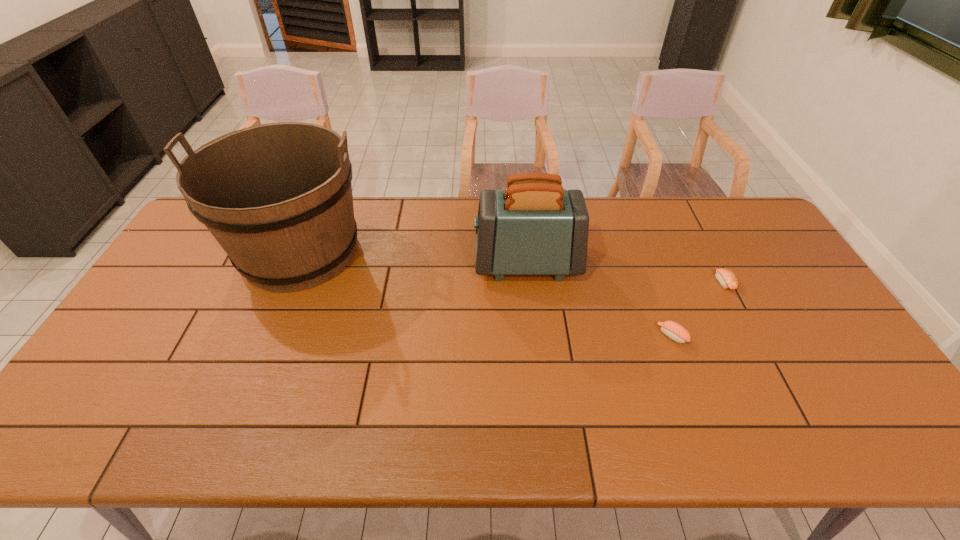
Identify the location of vacant region between the shorter sushi and the nearer sushi. (698, 309).

Find the location of a particular element. This screenshot has height=540, width=960. empty space between the bucket and the nearest object is located at coordinates (486, 294).

Locate an element on the screen. The height and width of the screenshot is (540, 960). vacant space in between the farther sushi and the toaster is located at coordinates (625, 273).

At what (x,y) coordinates should I click in order to perform the action: click on free area in between the third object from left to right and the leftmost object. Please return your answer as a coordinate pair (x, y). The height and width of the screenshot is (540, 960). Looking at the image, I should click on (486, 294).

This screenshot has height=540, width=960. Find the location of `vacant area that lies between the bucket and the second tallest object`. vacant area that lies between the bucket and the second tallest object is located at coordinates (414, 258).

The image size is (960, 540). Identify the location of empty space that is in between the taller sushi and the shorter sushi. (698, 309).

At what (x,y) coordinates should I click in order to perform the action: click on the closest object relative to the shorter sushi. Please return your answer as a coordinate pair (x, y). Looking at the image, I should click on tap(673, 330).

Choose which object is the second nearest neighbor to the third object from left to right. Please provide its 2D coordinates. Your answer should be formatted as a tuple, i.e. [(x, y)], where the tuple contains the x and y coordinates of a point satisfying the conditions above.

[(534, 227)]

Where is `vacant space that satisfies the following two spatial constraints: 1. on the front-facing side of the toaster; 2. on the right side of the rightmost object`? vacant space that satisfies the following two spatial constraints: 1. on the front-facing side of the toaster; 2. on the right side of the rightmost object is located at coordinates (529, 282).

You are a GUI agent. You are given a task and a screenshot of the screen. Output one action in this format:
    pyautogui.click(x=<x>, y=<y>)
    Task: Click on the free space that satisfies the following two spatial constraints: 1. on the front-facing side of the second tallest object; 2. on the back side of the second shortest object
    The image size is (960, 540).
    Given the screenshot: What is the action you would take?
    coord(535,336)